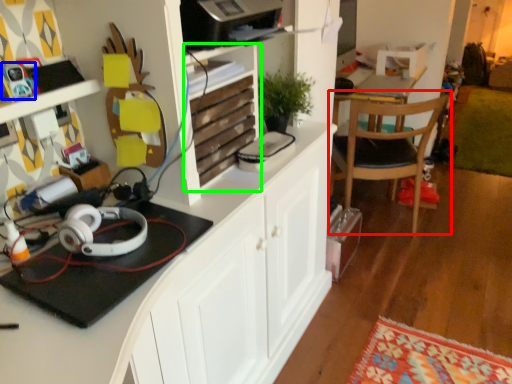
Question: Estimate the real-world distances between objects in this image. Which object is farther from chair (highlighted by a red box), toy (highlighted by a blue box) or shelf (highlighted by a green box)?

Choices:
 (A) toy
 (B) shelf

Answer: (A)